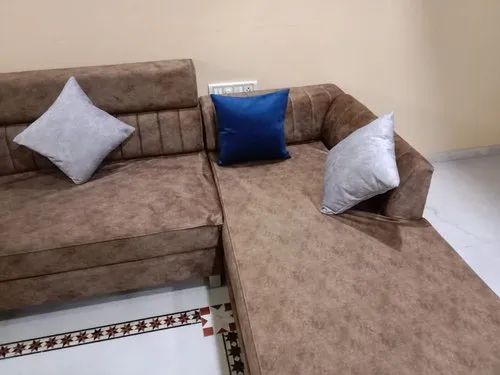
The image size is (500, 375). I want to click on left armrest, so click(x=356, y=117).